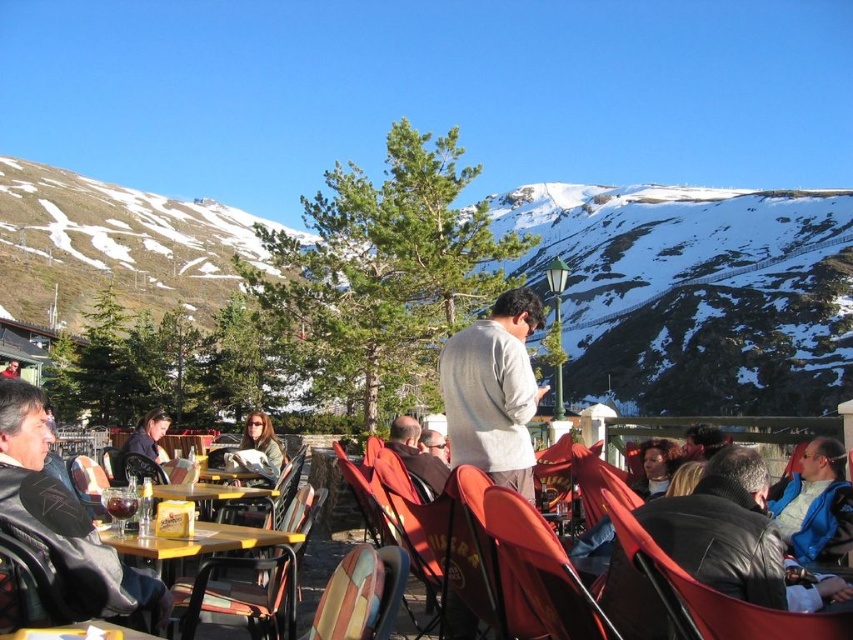
You are a customer at the outdoor seating area and want to sit on the black leather chair at lower right. However, there is a brown leather jacket at center placed on it. Can you sit there without moving the jacket?

The black leather chair at lower right is wider than the brown leather jacket at center, so you can sit on the black leather chair at lower right without moving the jacket because the chair has enough width to accommodate both the jacket and you.

You are a customer at this mountainous outdoor seating area and want to sit down. You see the leather jacket at lower left and the black leather chair at lower right. Which object is wider?

The leather jacket at lower left is wider than the black leather chair at lower right according to the description.